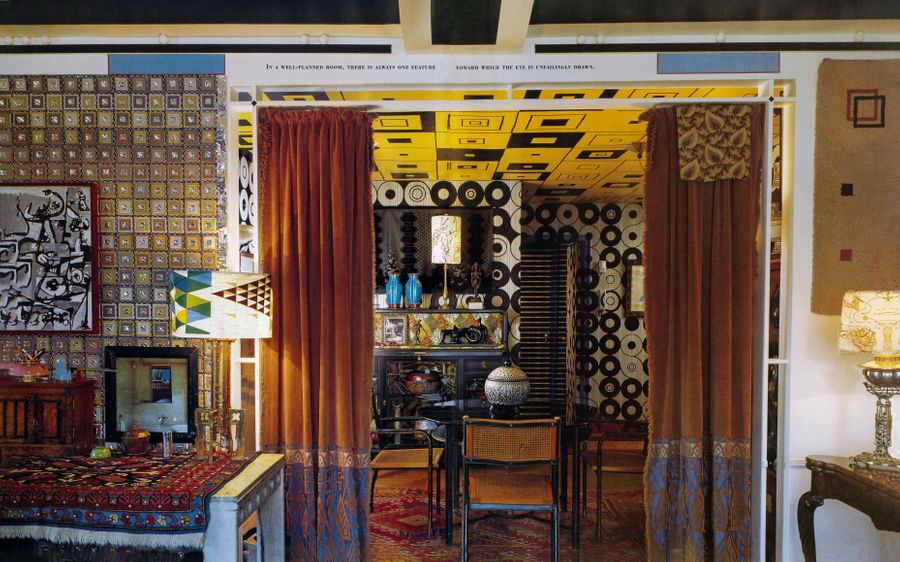
Locate an element on the screen. This screenshot has height=562, width=900. chair is located at coordinates (531, 483), (389, 456), (618, 465).